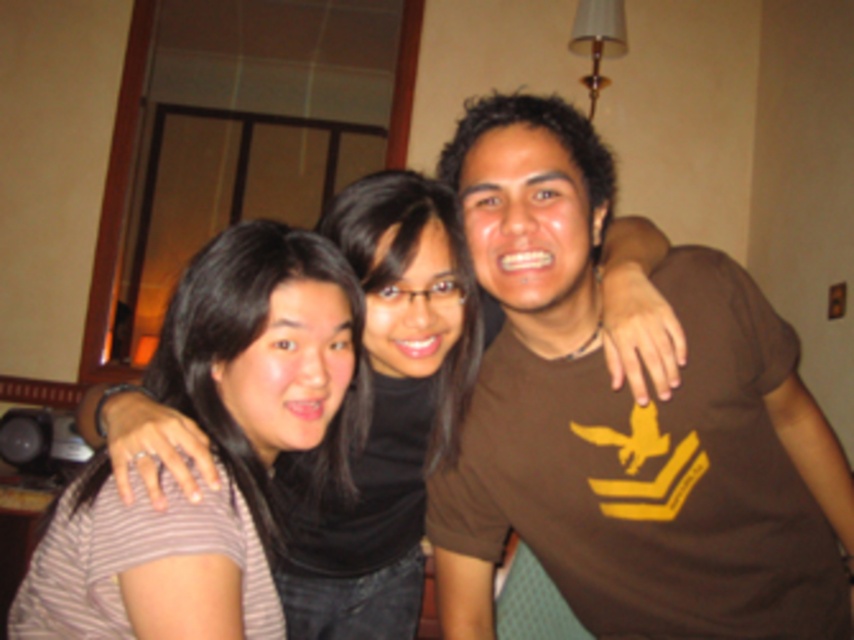
You are a photographer trying to adjust the lighting for a group photo. You notice two striped shirts in the scene. Which one is positioned further to the left between the striped fabric shirt at left and the matte striped shirt at left?

The striped fabric shirt at left is positioned further to the left compared to the matte striped shirt at left as per the description.

You are a photographer adjusting the lighting for a group photo. You notice two striped shirts on the left side of the frame. The first is labeled as striped fabric shirt at left and the second as matte striped shirt at left. To ensure both shirts are well lit, how far apart are these two striped shirts?

The striped fabric shirt at left and the matte striped shirt at left are 9.81 inches apart.